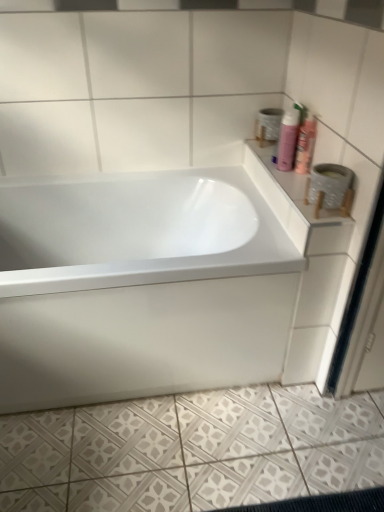
Measure the distance between white textured toilet paper at upper right and camera.

A distance of 1.10 meters exists between white textured toilet paper at upper right and camera.

Locate an element on the screen. The height and width of the screenshot is (512, 384). white textured toilet paper at upper right is located at coordinates (329, 184).

Image resolution: width=384 pixels, height=512 pixels. Describe the element at coordinates (140, 287) in the screenshot. I see `white glossy bathtub at center` at that location.

What do you see at coordinates (192, 451) in the screenshot?
I see `white textured tile at lower center` at bounding box center [192, 451].

Locate an element on the screen. This screenshot has height=512, width=384. white textured toilet paper at upper right is located at coordinates (329, 184).

Is white glossy bathtub at center facing towards pink matte shaving cream at upper right, the 1th shaving cream in the left-to-right sequence?

No.

This screenshot has width=384, height=512. Find the location of `shaving cream that is the 1st object above the white glossy bathtub at center (from a real-world perspective)`. shaving cream that is the 1st object above the white glossy bathtub at center (from a real-world perspective) is located at coordinates (288, 139).

Considering the sizes of objects white glossy bathtub at center and pink matte shaving cream at upper right, which is the second shaving cream in right-to-left order, in the image provided, who is smaller, white glossy bathtub at center or pink matte shaving cream at upper right, which is the second shaving cream in right-to-left order,?

pink matte shaving cream at upper right, which is the second shaving cream in right-to-left order, is smaller.

In the scene shown: From the image's perspective, relative to white glossy counter top at upper right, is white glossy bathtub at center above or below?

Clearly, from the image's perspective, white glossy bathtub at center is below white glossy counter top at upper right.

Considering the relative sizes of white glossy bathtub at center and white glossy counter top at upper right in the image provided, is white glossy bathtub at center smaller than white glossy counter top at upper right?

Actually, white glossy bathtub at center might be larger than white glossy counter top at upper right.

Is point (9, 301) less distant than point (307, 177)?

Yes, it is in front of point (307, 177).

How much distance is there between white glossy bathtub at center and white glossy counter top at upper right?

white glossy bathtub at center and white glossy counter top at upper right are 16.75 inches apart.

Considering the positions of objects white textured toilet paper at upper right and white textured tile at lower center in the image provided, who is more to the right, white textured toilet paper at upper right or white textured tile at lower center?

From the viewer's perspective, white textured toilet paper at upper right appears more on the right side.

Considering the sizes of objects white textured toilet paper at upper right and white textured tile at lower center in the image provided, who is wider, white textured toilet paper at upper right or white textured tile at lower center?

white textured tile at lower center is wider.

Is white textured toilet paper at upper right next to white textured tile at lower center and touching it?

No, white textured toilet paper at upper right is not in contact with white textured tile at lower center.

How many degrees apart are the facing directions of white textured toilet paper at upper right and white textured tile at lower center?

white textured toilet paper at upper right and white textured tile at lower center are facing 179 degrees away from each other.

Would you consider white textured tile at lower center to be distant from white glossy bathtub at center?

No.

Which of these two, white textured tile at lower center or white glossy bathtub at center, is thinner?

white glossy bathtub at center is thinner.

Which is less distant, (360, 396) or (241, 205)?

Point (360, 396).

How different are the orientations of white textured tile at lower center and white glossy bathtub at center in degrees?

The facing directions of white textured tile at lower center and white glossy bathtub at center are 89.9 degrees apart.

Does pink matte shaving cream at upper right, the 1th shaving cream in the left-to-right sequence, have a greater width compared to white textured toilet paper at upper right?

In fact, pink matte shaving cream at upper right, the 1th shaving cream in the left-to-right sequence, might be narrower than white textured toilet paper at upper right.

From a real-world perspective, is pink matte shaving cream at upper right, the 1th shaving cream in the left-to-right sequence, below white textured toilet paper at upper right?

No, from a real-world perspective, pink matte shaving cream at upper right, the 1th shaving cream in the left-to-right sequence, is not under white textured toilet paper at upper right.

Is pink matte shaving cream at upper right, the 1th shaving cream in the left-to-right sequence, located outside white textured toilet paper at upper right?

Absolutely, pink matte shaving cream at upper right, the 1th shaving cream in the left-to-right sequence, is external to white textured toilet paper at upper right.

The image size is (384, 512). I want to click on toilet paper in front of the pink matte shaving cream at upper right, which is the second shaving cream in right-to-left order, so click(x=329, y=184).

Is pink matte shaving cream at upper right, which appears as the 2th shaving cream when viewed from the left, closer to camera compared to white textured tile at lower center?

→ No, pink matte shaving cream at upper right, which appears as the 2th shaving cream when viewed from the left, is further to the viewer.

How much distance is there between pink matte shaving cream at upper right, the 1th shaving cream from the right, and white textured tile at lower center?

pink matte shaving cream at upper right, the 1th shaving cream from the right, and white textured tile at lower center are 38.03 inches apart.

Where is `ceramic tile below the pink matte shaving cream at upper right, which appears as the 2th shaving cream when viewed from the left (from the image's perspective)`? ceramic tile below the pink matte shaving cream at upper right, which appears as the 2th shaving cream when viewed from the left (from the image's perspective) is located at coordinates (192, 451).

Is pink matte shaving cream at upper right, the 1th shaving cream from the right, oriented away from white textured tile at lower center?

No.

In terms of width, does white textured toilet paper at upper right look wider or thinner when compared to white glossy bathtub at center?

In the image, white textured toilet paper at upper right appears to be more narrow than white glossy bathtub at center.

From the image's perspective, between white textured toilet paper at upper right and white glossy bathtub at center, which one is located above?

From the image's view, white textured toilet paper at upper right is above.

Locate an element on the screen. The image size is (384, 512). bathtub in front of the white textured toilet paper at upper right is located at coordinates (140, 287).

I want to click on bathtub on the left of pink matte shaving cream at upper right, which is the second shaving cream in right-to-left order, so click(x=140, y=287).

Image resolution: width=384 pixels, height=512 pixels. In order to click on counter top behind the white glossy bathtub at center in this screenshot , I will do `click(297, 207)`.

Looking at the image, which one is located further to pink matte shaving cream at upper right, which appears as the 2th shaving cream when viewed from the left, white glossy counter top at upper right or white textured toilet paper at upper right?

Among the two, white textured toilet paper at upper right is located further to pink matte shaving cream at upper right, which appears as the 2th shaving cream when viewed from the left.

Considering their positions, is pink matte shaving cream at upper right, the 1th shaving cream from the right, positioned further to white glossy bathtub at center than white textured toilet paper at upper right?

The object further to white glossy bathtub at center is pink matte shaving cream at upper right, the 1th shaving cream from the right.

From the image, which object appears to be nearer to pink matte shaving cream at upper right, which appears as the 2th shaving cream when viewed from the left, white glossy counter top at upper right or pink matte shaving cream at upper right, the 1th shaving cream in the left-to-right sequence?

pink matte shaving cream at upper right, the 1th shaving cream in the left-to-right sequence, is closer to pink matte shaving cream at upper right, which appears as the 2th shaving cream when viewed from the left.

When comparing their distances from white glossy bathtub at center, does pink matte shaving cream at upper right, which is the second shaving cream in right-to-left order, or white glossy counter top at upper right seem closer?

white glossy counter top at upper right is closer to white glossy bathtub at center.

Based on the photo, looking at the image, which one is located closer to pink matte shaving cream at upper right, which is the second shaving cream in right-to-left order, white glossy counter top at upper right or pink matte shaving cream at upper right, the 1th shaving cream from the right?

pink matte shaving cream at upper right, the 1th shaving cream from the right.

Based on their spatial positions, is white glossy counter top at upper right or pink matte shaving cream at upper right, which appears as the 2th shaving cream when viewed from the left, further from white glossy bathtub at center?

pink matte shaving cream at upper right, which appears as the 2th shaving cream when viewed from the left, is positioned further to the anchor white glossy bathtub at center.

From the picture: Considering their positions, is white glossy counter top at upper right positioned further to white textured tile at lower center than pink matte shaving cream at upper right, which is the second shaving cream in right-to-left order?

pink matte shaving cream at upper right, which is the second shaving cream in right-to-left order, is positioned further to the anchor white textured tile at lower center.

Based on their spatial positions, is white textured toilet paper at upper right or white glossy bathtub at center closer to pink matte shaving cream at upper right, the 1th shaving cream in the left-to-right sequence?

Among the two, white textured toilet paper at upper right is located nearer to pink matte shaving cream at upper right, the 1th shaving cream in the left-to-right sequence.

Where is `counter top between white textured toilet paper at upper right and pink matte shaving cream at upper right, which appears as the 2th shaving cream when viewed from the left, from front to back`? The width and height of the screenshot is (384, 512). counter top between white textured toilet paper at upper right and pink matte shaving cream at upper right, which appears as the 2th shaving cream when viewed from the left, from front to back is located at coordinates (297, 207).

In order to click on counter top that lies between pink matte shaving cream at upper right, which is the second shaving cream in right-to-left order, and white textured tile at lower center from top to bottom in this screenshot , I will do `click(297, 207)`.

At what (x,y) coordinates should I click in order to perform the action: click on bathtub between pink matte shaving cream at upper right, the 1th shaving cream in the left-to-right sequence, and white textured tile at lower center vertically. Please return your answer as a coordinate pair (x, y). The height and width of the screenshot is (512, 384). Looking at the image, I should click on (140, 287).

Find the location of a particular element. The image size is (384, 512). shaving cream between white glossy bathtub at center and pink matte shaving cream at upper right, the 1th shaving cream from the right, from left to right is located at coordinates (288, 139).